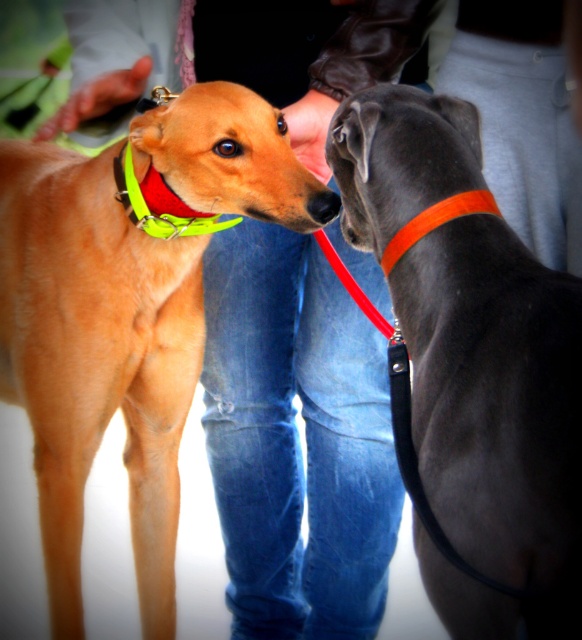
You are standing at a dog event and want to take a photo of the two dogs. The camera you have can focus on objects within 2 meters. Is the point at coordinates point (101, 413) within the camera focus range?

The distance between point (101, 413) and the viewer is 1.99 meters, which is within the camera focus range of 2 meters. Therefore, the camera can focus on the point (101, 413).

You are at a dog event and want to take a photo of both dogs. The dogs are at positions marked by point (169, 369) and point (331, 212). To ensure both are in focus, which point should you focus on first?

You should focus on point (169, 369) first because it is closer to the camera than point (331, 212), ensuring both dogs are in focus.

You are a photographer at the event and want to place a small prop at the center of the image. The green fabric neckband at left is at position coordinates 0.319, 0.275. Is the neckband closer to the left or right edge of the image?

The green fabric neckband at left is located at point (x=159, y=204). Since the x coordinate is 0.319, which is less than 0.5, it is closer to the left edge of the image.